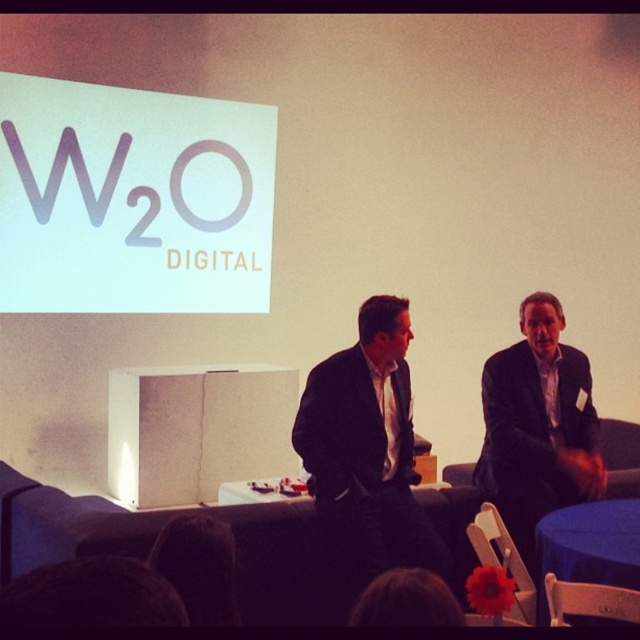
Is white paper at upper left wider than dark suit at center?

Yes.

Is point (196, 161) in front of point (541, 372)?

No, (196, 161) is further to viewer.

The height and width of the screenshot is (640, 640). In order to click on white paper at upper left in this screenshot , I will do `click(132, 198)`.

Can you confirm if black suit at center is smaller than blue fabric table at lower right?

Incorrect, black suit at center is not smaller in size than blue fabric table at lower right.

Between black suit at center and blue fabric table at lower right, which one has more height?

With more height is black suit at center.

Is point (337, 444) positioned before point (637, 506)?

Yes.

The image size is (640, 640). I want to click on black suit at center, so click(368, 449).

Which of these two, white paper at upper left or black suit at center, stands shorter?

With less height is black suit at center.

Which is behind, point (179, 202) or point (381, 483)?

Point (179, 202)

Image resolution: width=640 pixels, height=640 pixels. Describe the element at coordinates (132, 198) in the screenshot. I see `white paper at upper left` at that location.

I want to click on white paper at upper left, so click(x=132, y=198).